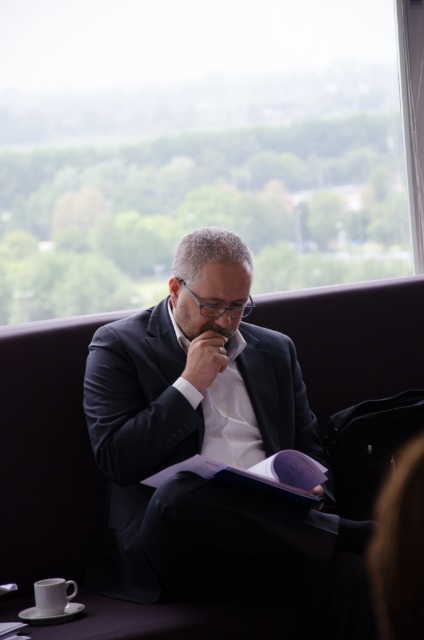
Is dark suit at center wider than white ceramic mug at lower left?

Yes.

Between dark suit at center and white ceramic mug at lower left, which one has less height?

Standing shorter between the two is white ceramic mug at lower left.

Between point (268, 444) and point (45, 611), which one is positioned in front?

Point (45, 611) is in front.

Identify the location of dark suit at center. The width and height of the screenshot is (424, 640). (204, 444).

Is white ceramic mug at lower left below matte skin at center?

Yes.

Is white ceramic mug at lower left taller than matte skin at center?

Yes.

This screenshot has width=424, height=640. Describe the element at coordinates (53, 595) in the screenshot. I see `white ceramic mug at lower left` at that location.

I want to click on white ceramic mug at lower left, so click(x=53, y=595).

Is dark suit at center shorter than matte skin at center?

In fact, dark suit at center may be taller than matte skin at center.

Between point (240, 252) and point (204, 324), which one is positioned in front?

Point (240, 252)

Find the location of a particular element. This screenshot has height=640, width=424. dark suit at center is located at coordinates (204, 444).